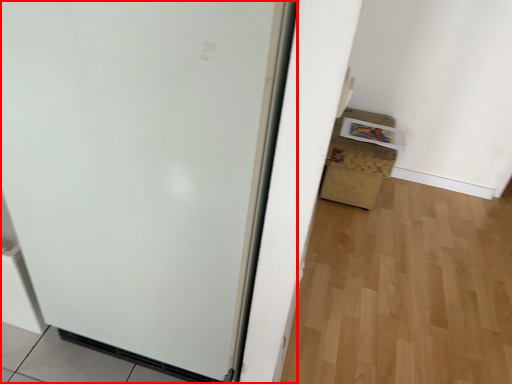
Question: From the image's perspective, where is door (annotated by the red box) located relative to cardboard box?

Choices:
 (A) below
 (B) above

Answer: (A)